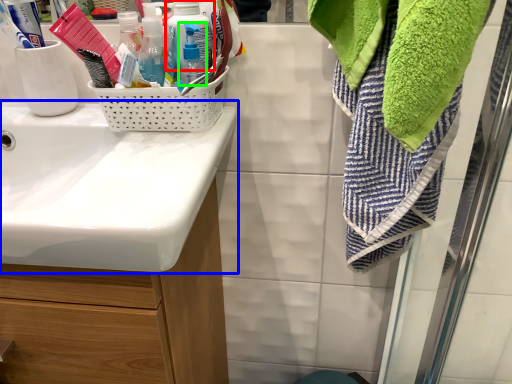
Question: Considering the real-world distances, which object is farthest from bottle (highlighted by a red box)? sink (highlighted by a blue box) or bottle (highlighted by a green box)?

Choices:
 (A) sink
 (B) bottle

Answer: (A)